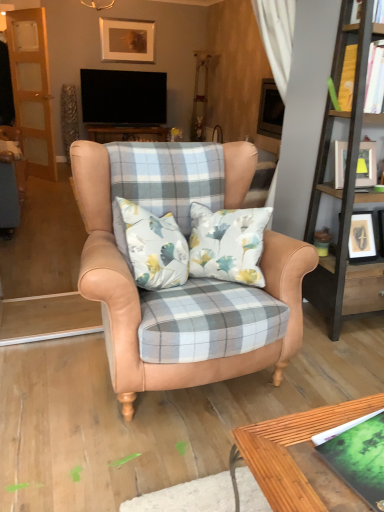
What are the coordinates of `free space above green matte book at lower right, which appears as the second book when viewed from the back (from a real-world perspective)` in the screenshot? It's located at point(365,442).